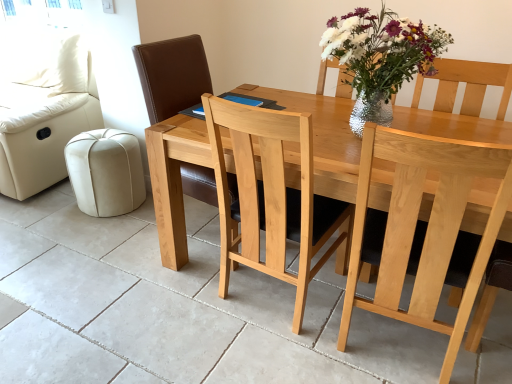
Question: Is natural wood chair at center, the first chair positioned from the left, further to camera compared to light wood chair at center, the 2th chair in the left-to-right sequence?

Choices:
 (A) yes
 (B) no

Answer: (A)

Question: From the image's perspective, does natural wood chair at center, the first chair positioned from the left, appear lower than light wood chair at center, the 2th chair in the left-to-right sequence?

Choices:
 (A) yes
 (B) no

Answer: (B)

Question: Is the position of natural wood chair at center, which appears as the second chair when viewed from the right, less distant than that of light wood chair at center, the 2th chair in the left-to-right sequence?

Choices:
 (A) no
 (B) yes

Answer: (A)

Question: Can you confirm if natural wood chair at center, the first chair positioned from the left, is positioned to the right of light wood chair at center, the 2th chair in the left-to-right sequence?

Choices:
 (A) yes
 (B) no

Answer: (B)

Question: Considering the relative sizes of natural wood chair at center, which appears as the second chair when viewed from the right, and light wood chair at center, the 2th chair in the left-to-right sequence, in the image provided, is natural wood chair at center, which appears as the second chair when viewed from the right, shorter than light wood chair at center, the 2th chair in the left-to-right sequence,?

Choices:
 (A) yes
 (B) no

Answer: (B)

Question: In terms of size, does beige leather ottoman at lower left appear bigger or smaller than natural wood chair at center, the first chair positioned from the left?

Choices:
 (A) small
 (B) big

Answer: (A)

Question: Considering the positions of point (106, 142) and point (187, 192), is point (106, 142) closer or farther from the camera than point (187, 192)?

Choices:
 (A) farther
 (B) closer

Answer: (A)

Question: In the image, is beige leather ottoman at lower left positioned in front of or behind natural wood chair at center, which appears as the second chair when viewed from the right?

Choices:
 (A) behind
 (B) front

Answer: (A)

Question: Considering the positions of beige leather ottoman at lower left and natural wood chair at center, the first chair positioned from the left, in the image, is beige leather ottoman at lower left wider or thinner than natural wood chair at center, the first chair positioned from the left,?

Choices:
 (A) wide
 (B) thin

Answer: (B)

Question: From a real-world perspective, is cream leather couch at left above or below light wood chair at center, which is the 1th chair from right to left?

Choices:
 (A) above
 (B) below

Answer: (A)

Question: Is cream leather couch at left bigger or smaller than light wood chair at center, the 2th chair in the left-to-right sequence?

Choices:
 (A) small
 (B) big

Answer: (B)

Question: Is cream leather couch at left taller or shorter than light wood chair at center, the 2th chair in the left-to-right sequence?

Choices:
 (A) tall
 (B) short

Answer: (B)

Question: From the image's perspective, is cream leather couch at left above or below light wood chair at center, which is the 1th chair from right to left?

Choices:
 (A) above
 (B) below

Answer: (A)

Question: From a real-world perspective, is light wood chair at center, which is the 1th chair from right to left, physically located above or below natural wood chair at center, the first chair positioned from the left?

Choices:
 (A) below
 (B) above

Answer: (A)

Question: Would you say light wood chair at center, which is the 1th chair from right to left, is to the left or to the right of natural wood chair at center, the first chair positioned from the left, in the picture?

Choices:
 (A) left
 (B) right

Answer: (B)